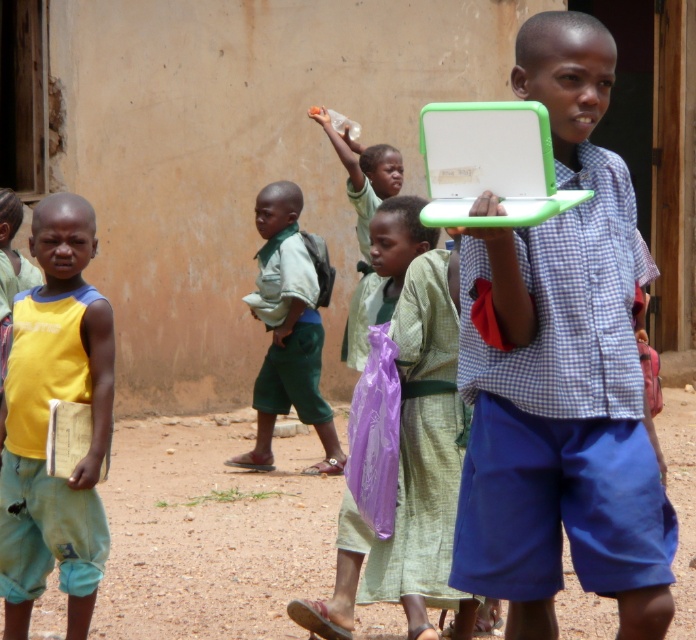
Question: Among these points, which one is nearest to the camera?

Choices:
 (A) (522, 205)
 (B) (633, 624)
 (C) (90, 346)
 (D) (283, 273)

Answer: (A)

Question: Which is farther from the green plastic laptop at center?

Choices:
 (A) yellow fabric shirt at left
 (B) matte green laptop at center

Answer: (A)

Question: Is yellow fabric shirt at left below green plastic laptop at center?

Choices:
 (A) no
 (B) yes

Answer: (B)

Question: Does yellow fabric shirt at left appear over green plastic laptop at center?

Choices:
 (A) no
 (B) yes

Answer: (A)

Question: Can you confirm if yellow fabric shirt at left is smaller than green plastic laptop at center?

Choices:
 (A) yes
 (B) no

Answer: (B)

Question: Which object is closer to the camera taking this photo?

Choices:
 (A) green fabric shirt at center
 (B) yellow fabric shirt at left

Answer: (B)